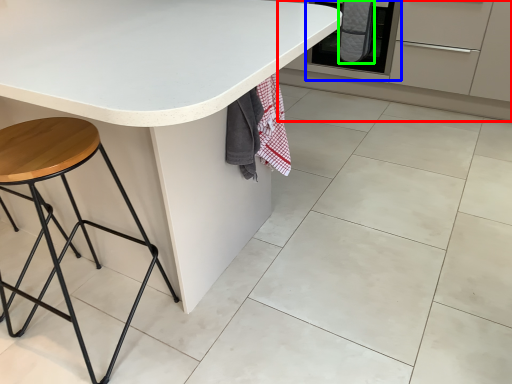
Question: Which object is positioned farthest from cabinetry (highlighted by a red box)? Select from oven (highlighted by a blue box) and blanket (highlighted by a green box).

Choices:
 (A) oven
 (B) blanket

Answer: (B)